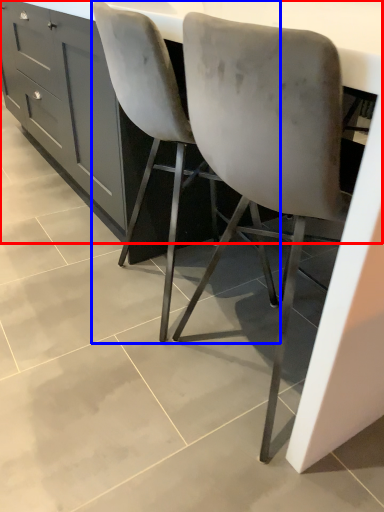
Question: Which object is further to the camera taking this photo, counter (highlighted by a red box) or chair (highlighted by a blue box)?

Choices:
 (A) counter
 (B) chair

Answer: (B)